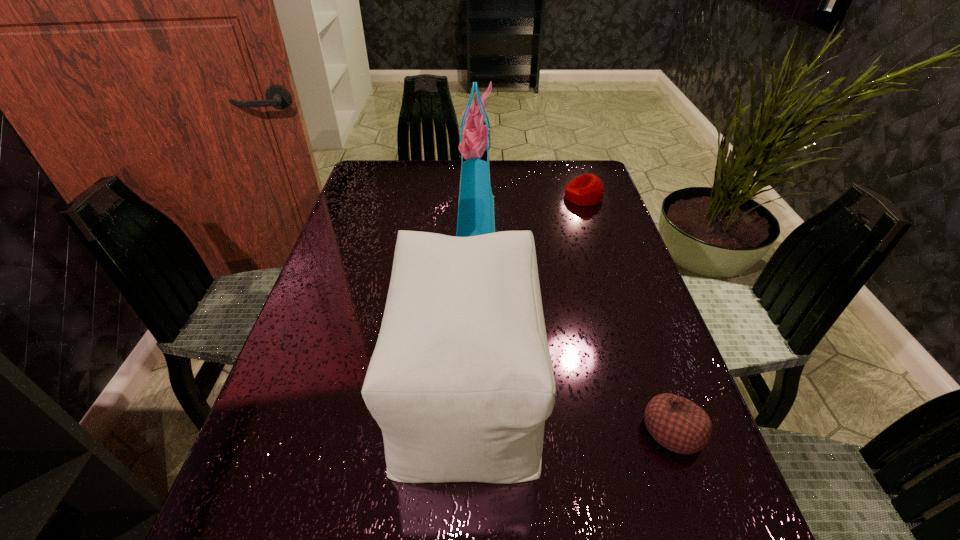
This screenshot has width=960, height=540. I want to click on shopping bag that is at the far edge, so click(476, 217).

Locate an element on the screen. The height and width of the screenshot is (540, 960). beanbag that is at the far edge is located at coordinates pos(586,190).

Find the location of a particular element. Image resolution: width=960 pixels, height=540 pixels. object at the far right corner is located at coordinates (586, 190).

Find the location of a particular element. vacant space at the far edge is located at coordinates (521, 191).

Image resolution: width=960 pixels, height=540 pixels. Find the location of `vacant area at the left edge`. vacant area at the left edge is located at coordinates (263, 438).

The image size is (960, 540). I want to click on blank space at the right edge of the desktop, so click(639, 270).

You are a GUI agent. You are given a task and a screenshot of the screen. Output one action in this format:
    pyautogui.click(x=<x>, y=<y>)
    Task: Click on the vacant region at the far left corner of the desktop
    
    Given the screenshot: What is the action you would take?
    pyautogui.click(x=372, y=175)

Find the location of a particular element. free area in between the nearer beanbag and the shopping bag is located at coordinates (575, 324).

The image size is (960, 540). I want to click on free space between the farther beanbag and the nearer beanbag, so [628, 313].

At what (x,y) coordinates should I click in order to perform the action: click on free space between the farther beanbag and the tallest object. Please return your answer as a coordinate pair (x, y). The width and height of the screenshot is (960, 540). Looking at the image, I should click on (530, 207).